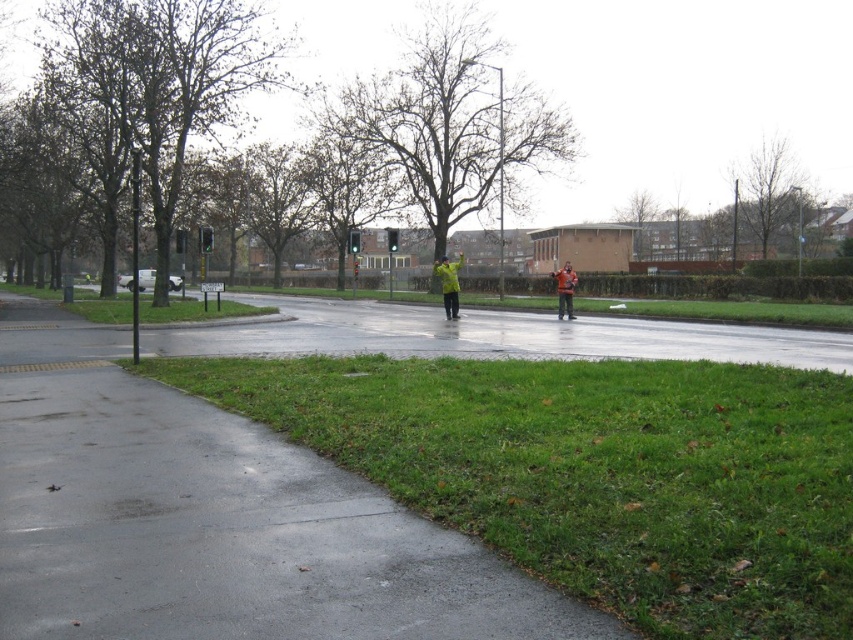
You are a pedestrian crossing the street and see both the yellow reflective jacket at center and the orange fabric jacket at center. Which jacket would you notice first?

The yellow reflective jacket at center is smaller than the orange fabric jacket at center, but the reflective material might make it more noticeable despite its size. However, based solely on size, the orange fabric jacket at center is larger and would likely be noticed first.

You are a delivery person holding a package and need to place it on the sidewalk. You see the green grass at lower right and the orange fabric jacket at center. Which surface is more suitable for placing the package?

The orange fabric jacket at center is more suitable for placing the package because the green grass at lower right might be wider than the orange fabric jacket at center, but grass is not a stable surface for placing items.

You are a pedestrian standing on the sidewalk and want to cross the road to reach the yellow reflective jacket at center. Is the green grass at lower right between you and the jacket?

Yes, the green grass at lower right is in front of the yellow reflective jacket at center, so it is between you and the jacket.